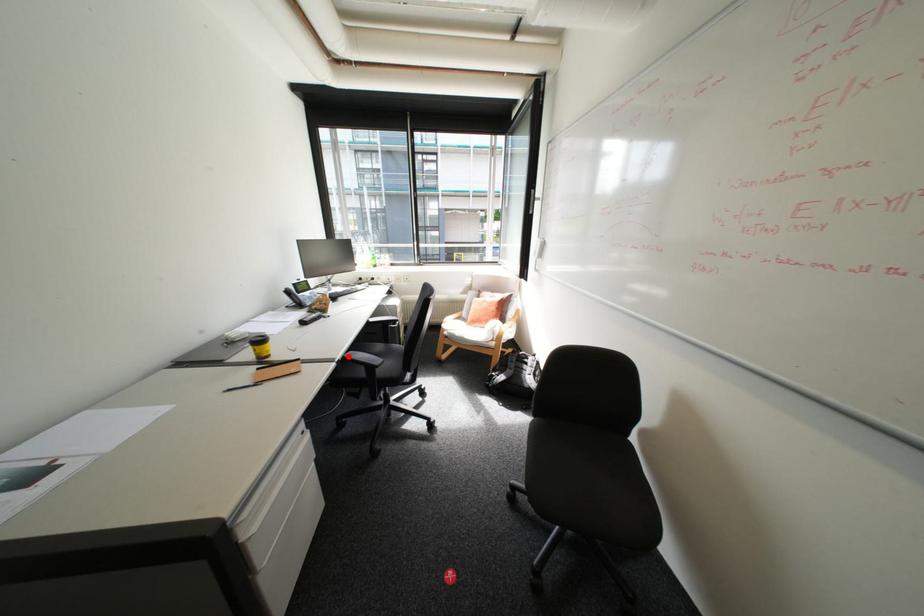
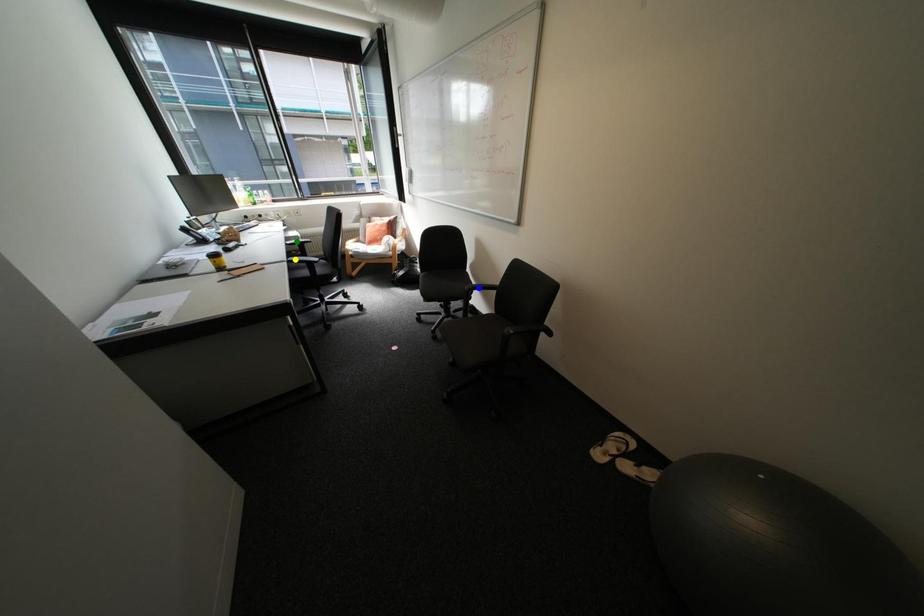
Question: I am providing you with two images of the same scene from different viewpoints. A red point is marked on the first image. You are given multiple points on the second image. Which mark in image 2 goes with the point in image 1?

Choices:
 (A) green point
 (B) yellow point
 (C) blue point

Answer: (B)